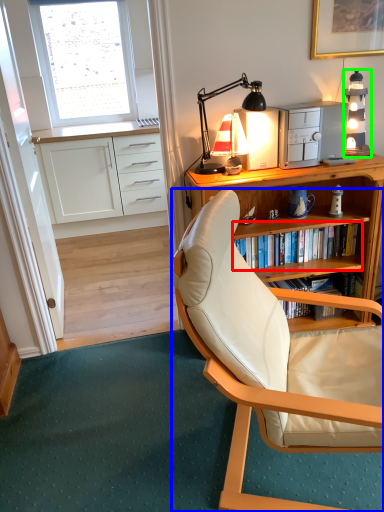
Question: Based on their relative distances, which object is farther from shelf (highlighted by a red box)? Choose from chair (highlighted by a blue box) and lamp (highlighted by a green box).

Choices:
 (A) chair
 (B) lamp

Answer: (A)